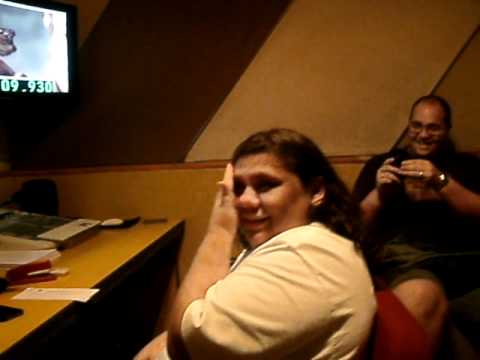
Locate an element on the screen. The width and height of the screenshot is (480, 360). long black blurry item on desk at the corner is located at coordinates (159, 219).